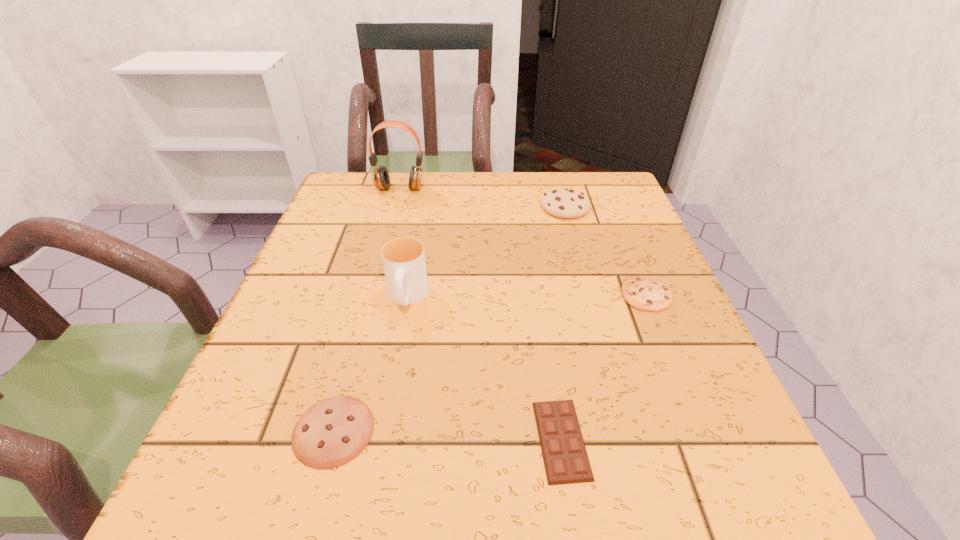
The image size is (960, 540). I want to click on the farthest object, so coord(380,175).

Find the location of a particular element. This screenshot has height=540, width=960. headset is located at coordinates (380, 175).

The image size is (960, 540). In order to click on cup in this screenshot , I will do `click(403, 258)`.

Where is `the second farthest object`? Image resolution: width=960 pixels, height=540 pixels. the second farthest object is located at coordinates click(564, 203).

Find the location of `the farthest cookie`. the farthest cookie is located at coordinates (564, 203).

The width and height of the screenshot is (960, 540). In order to click on the second farthest cookie in this screenshot , I will do `click(646, 293)`.

Locate an element on the screen. This screenshot has width=960, height=540. the rightmost cookie is located at coordinates (646, 293).

The height and width of the screenshot is (540, 960). I want to click on the leftmost cookie, so click(x=332, y=432).

Locate an element on the screen. the shortest object is located at coordinates (565, 458).

This screenshot has height=540, width=960. I want to click on vacant space located 0.340m on the ear cups of the tallest object, so tap(373, 285).